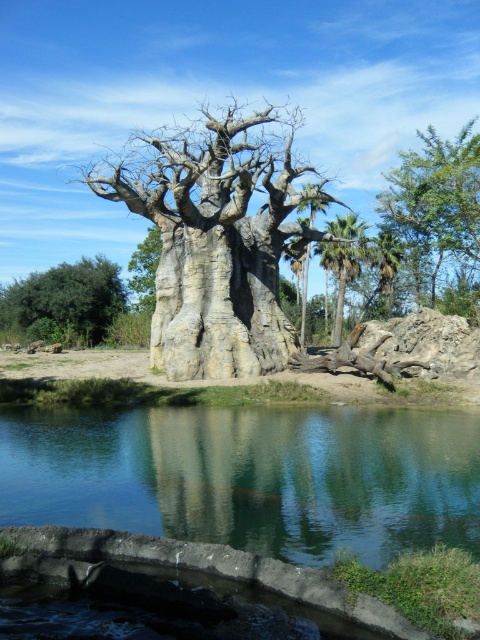
Question: Is gray rough textured tree at center behind green leafy tree at upper right?

Choices:
 (A) no
 (B) yes

Answer: (A)

Question: Among these points, which one is nearest to the camera?

Choices:
 (A) (468, 426)
 (B) (324, 252)
 (C) (253, 282)

Answer: (A)

Question: In this image, where is clear glass water at lower center located relative to green leafy tree at upper right?

Choices:
 (A) right
 (B) left

Answer: (B)

Question: Based on their relative distances, which object is nearer to the clear glass water at lower center?

Choices:
 (A) rough bark tree at center
 (B) green leafy tree at upper right
 (C) gray rough textured tree at center
 (D) green leafy tree at lower left

Answer: (C)

Question: Is rough bark tree at center positioned behind green leafy palm tree at upper right?

Choices:
 (A) no
 (B) yes

Answer: (B)

Question: Which point is farther to the camera?

Choices:
 (A) clear glass water at lower center
 (B) green leafy palm tree at center
 (C) green leafy palm tree at upper right
 (D) green leafy tree at upper right

Answer: (C)